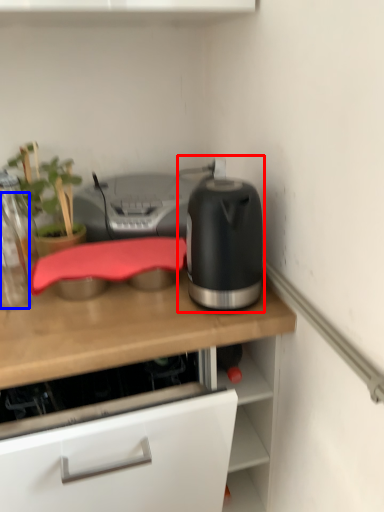
Question: Which object appears farthest to the camera in this image, kitchen appliance (highlighted by a red box) or bottle (highlighted by a blue box)?

Choices:
 (A) kitchen appliance
 (B) bottle

Answer: (B)